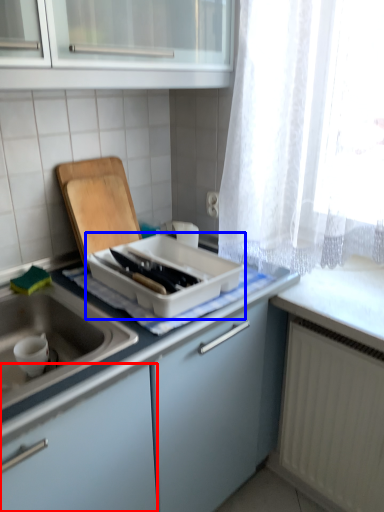
Question: Which of the following is the farthest to the observer, cabinetry (highlighted by a red box) or kitchen appliance (highlighted by a blue box)?

Choices:
 (A) cabinetry
 (B) kitchen appliance

Answer: (B)